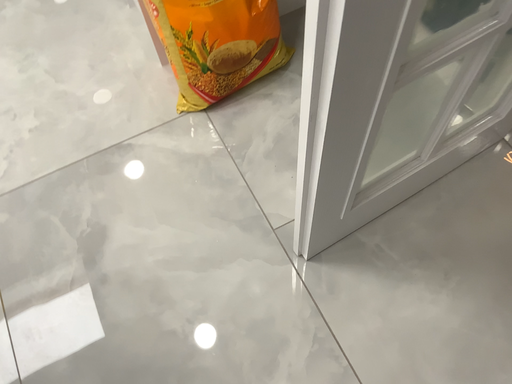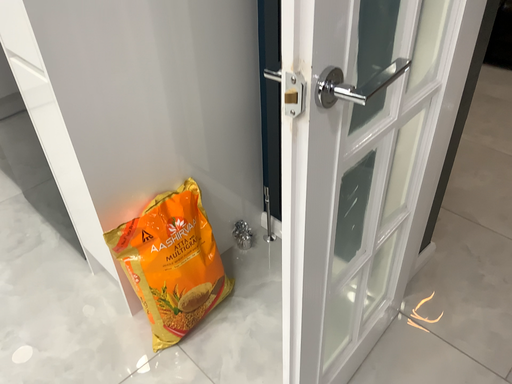
Question: Which way did the camera rotate in the video?

Choices:
 (A) rotated left
 (B) rotated right

Answer: (B)